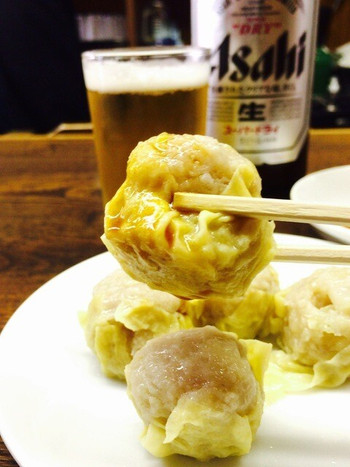
At what (x,y) coordinates should I click in order to perform the action: click on beer bottle. Please return your answer as a coordinate pair (x, y). The width and height of the screenshot is (350, 467). Looking at the image, I should click on (279, 26).